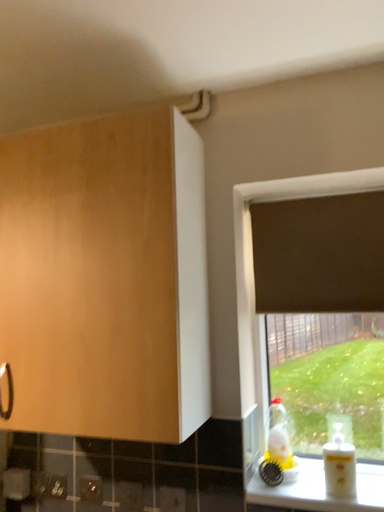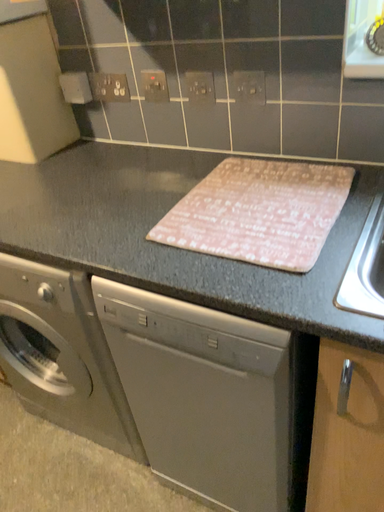
Question: Which way did the camera rotate in the video?

Choices:
 (A) rotated downward
 (B) rotated upward

Answer: (A)